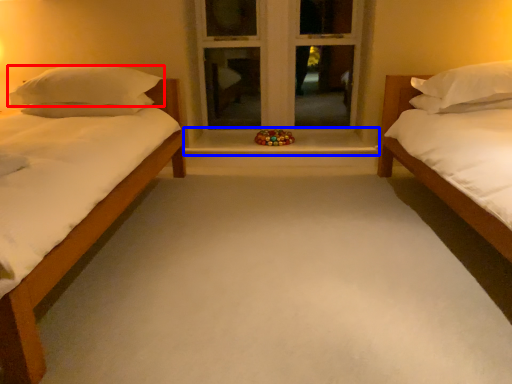
Question: Which object appears farthest to the camera in this image, pillow (highlighted by a red box) or window sill (highlighted by a blue box)?

Choices:
 (A) pillow
 (B) window sill

Answer: (B)